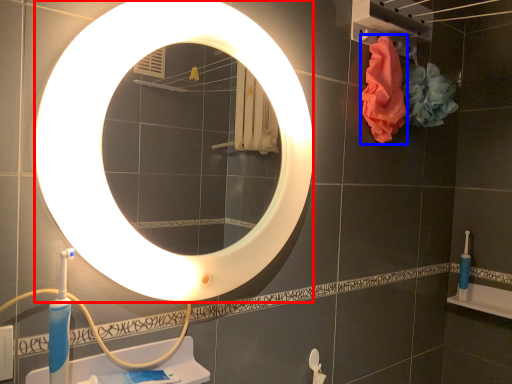
Question: Among these objects, which one is farthest to the camera, mirror (highlighted by a red box) or material (highlighted by a blue box)?

Choices:
 (A) mirror
 (B) material

Answer: (B)